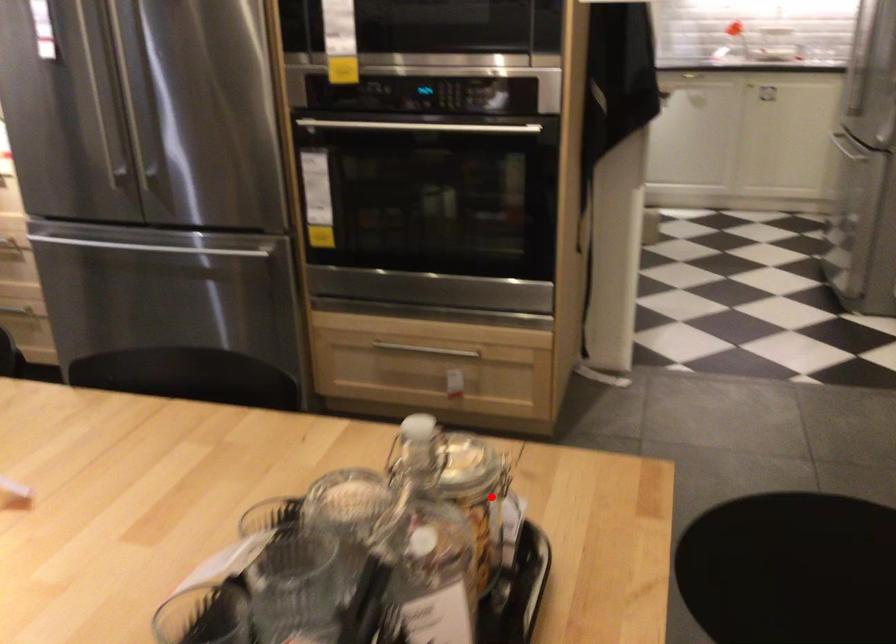
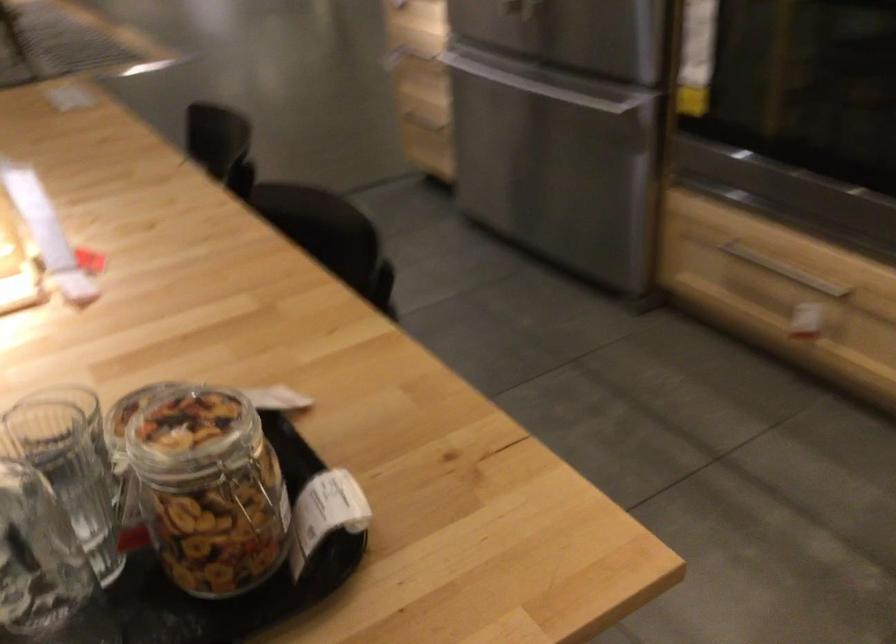
Find the pixel in the second image that matches the highlighted location in the first image.

(209, 489)